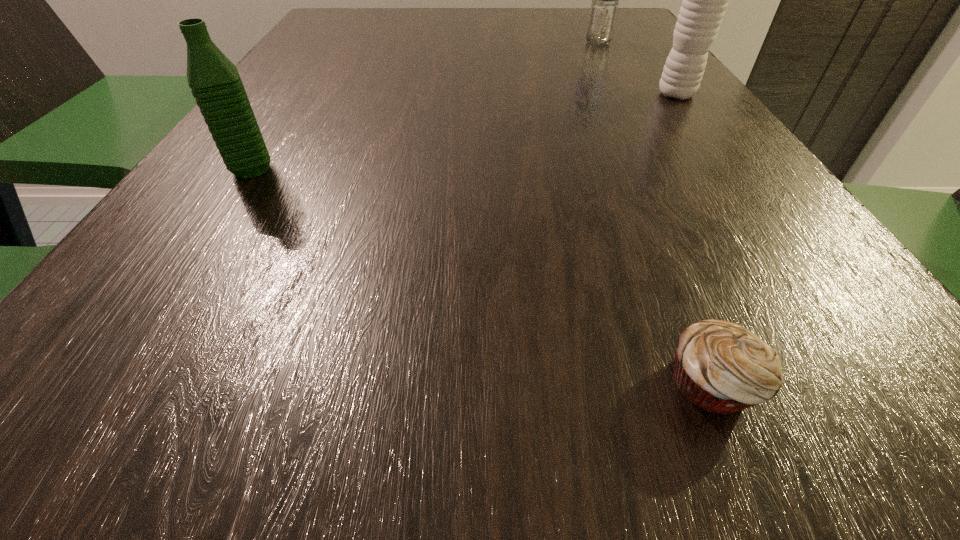
Image resolution: width=960 pixels, height=540 pixels. I want to click on free point located 0.080m on the front of the leftmost water bottle, so click(x=220, y=219).

Identify the location of vacant space located on the back of the muffin. The image size is (960, 540). (620, 160).

Identify the location of object at the far edge. (603, 11).

The height and width of the screenshot is (540, 960). What are the coordinates of `object located in the near edge section of the desktop` in the screenshot? It's located at (721, 367).

Locate an element on the screen. The height and width of the screenshot is (540, 960). object situated at the left edge is located at coordinates (214, 80).

Where is `muffin positioned at the right edge`? muffin positioned at the right edge is located at coordinates (721, 367).

At what (x,y) coordinates should I click in order to perform the action: click on object situated at the far right corner. Please return your answer as a coordinate pair (x, y). The image size is (960, 540). Looking at the image, I should click on (603, 11).

Locate an element on the screen. Image resolution: width=960 pixels, height=540 pixels. object at the near right corner is located at coordinates (721, 367).

Identify the location of vacant space at the far edge of the desktop. Image resolution: width=960 pixels, height=540 pixels. (539, 15).

Locate an element on the screen. Image resolution: width=960 pixels, height=540 pixels. vacant space at the near edge is located at coordinates [x=734, y=469].